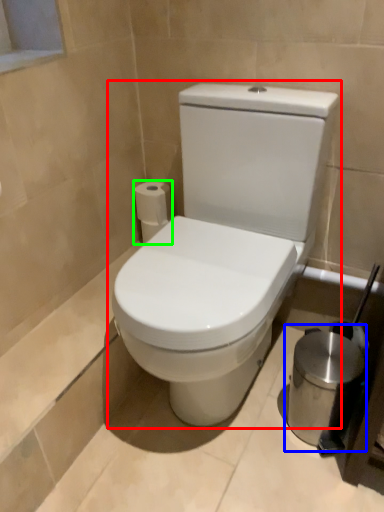
Question: Based on their relative distances, which object is nearer to toilet (highlighted by a red box)? Choose from appliance (highlighted by a blue box) and toilet paper (highlighted by a green box).

Choices:
 (A) appliance
 (B) toilet paper

Answer: (A)